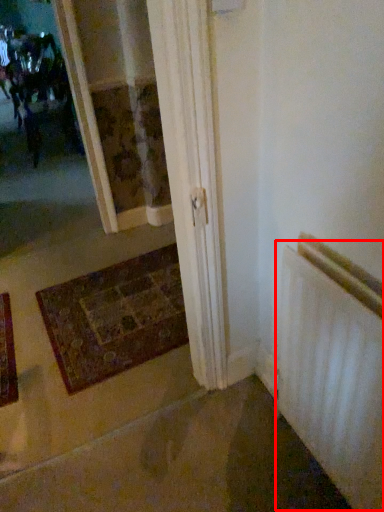
Question: Observing the image, what is the correct spatial positioning of radiator (annotated by the red box) in reference to mat?

Choices:
 (A) left
 (B) right

Answer: (B)